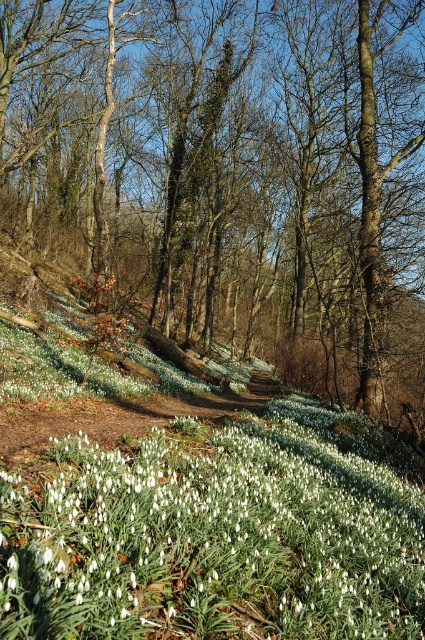
Describe the element at coordinates (229, 172) in the screenshot. I see `brown bark tree at center` at that location.

Which is above, brown bark tree at center or white matte snowdrop at center?

brown bark tree at center is higher up.

What do you see at coordinates (229, 172) in the screenshot?
I see `brown bark tree at center` at bounding box center [229, 172].

Where is `brown bark tree at center`? brown bark tree at center is located at coordinates (229, 172).